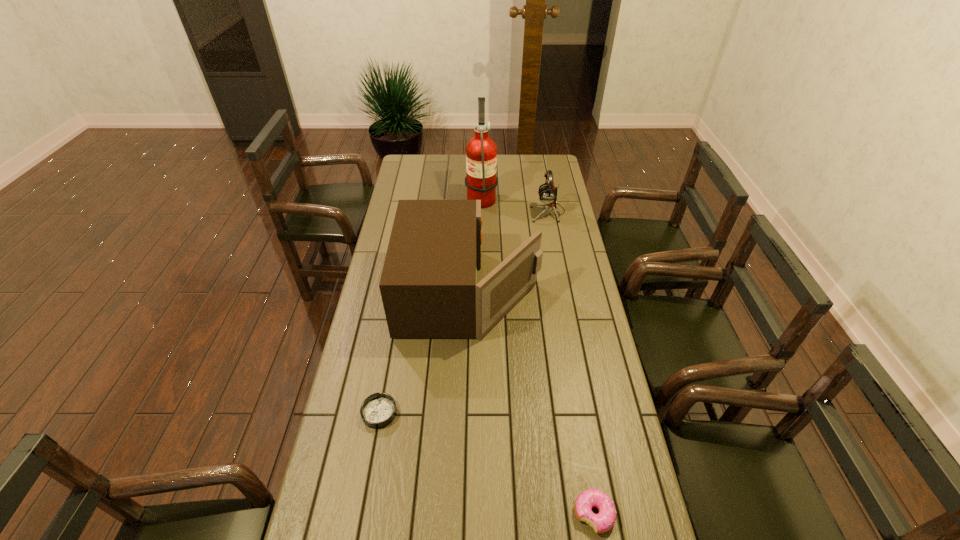
Locate an element on the screen. vacant space located 0.090m on the nozzle and handle of the fire extinguisher is located at coordinates (447, 197).

Image resolution: width=960 pixels, height=540 pixels. What are the coordinates of `free location located with the door open on the front of the third farthest object` in the screenshot? It's located at (570, 293).

Where is `vacant position located 0.140m on the front of the third tallest object`? This screenshot has width=960, height=540. vacant position located 0.140m on the front of the third tallest object is located at coordinates (554, 242).

The width and height of the screenshot is (960, 540). What are the coordinates of `free location located on the left of the doughnut` in the screenshot? It's located at (527, 514).

Identify the location of vacant space located 0.120m on the front of the fourth farthest object. (369, 470).

Where is `microwave oven that is at the left edge`? microwave oven that is at the left edge is located at coordinates pyautogui.click(x=428, y=285).

You are a GUI agent. You are given a task and a screenshot of the screen. Output one action in this format:
    pyautogui.click(x=<x>, y=<y>)
    Task: Click on the ashtray that is positioned at the left edge
    This screenshot has width=960, height=540.
    Given the screenshot: What is the action you would take?
    pyautogui.click(x=378, y=410)

Find the location of a particular element. Image resolution: width=960 pixels, height=540 pixels. earphone situated at the right edge is located at coordinates (547, 194).

Identify the location of doughnut that is at the right edge. The image size is (960, 540). (602, 522).

The image size is (960, 540). In the image, there is a desktop. Identify the location of free region at the far edge. click(x=518, y=176).